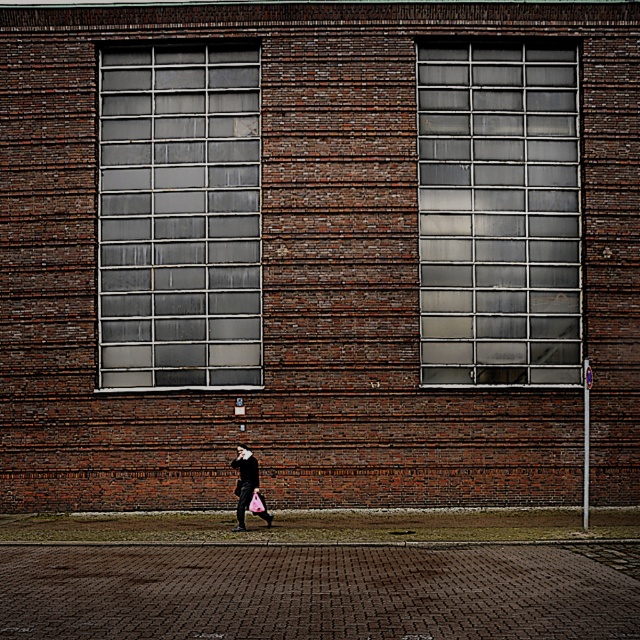
You are standing in front of the brick wall and notice the brick pavement at lower center and the black matte coat at center. Which object has a greater width?

The brick pavement at lower center has a greater width than the black matte coat at center.

You are standing in front of the brick wall and looking at two points marked on the image. Which point, point (404, 586) or point (244, 468), is closer to you?

Point (404, 586) is closer to you than point (244, 468).

You are standing on the brick pavement at lower center and want to reach the black matte coat at center. Which direction should you move to get closer?

The brick pavement at lower center is in front of the black matte coat at center, so you should move backward to reach the black matte coat at center.